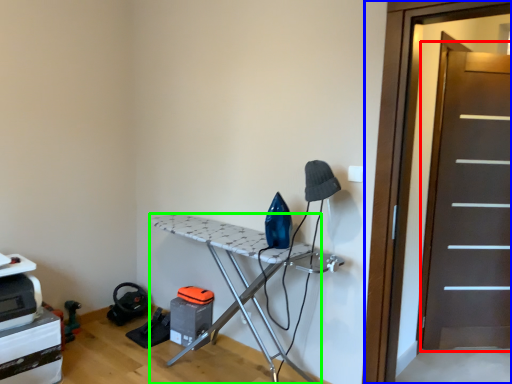
Question: Considering the real-world distances, which object is farthest from screen door (highlighted by a red box)? screen door (highlighted by a blue box) or furniture (highlighted by a green box)?

Choices:
 (A) screen door
 (B) furniture

Answer: (B)